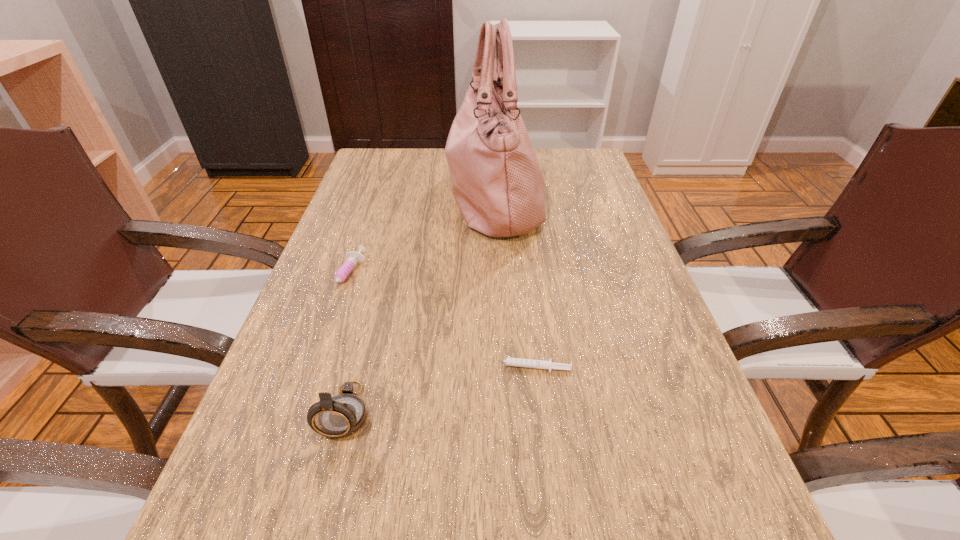
The width and height of the screenshot is (960, 540). Identify the location of vacant point located at the front of the tallest object with handles. pos(415,196).

Locate an element on the screen. This screenshot has width=960, height=540. blank space located on the face of the second tallest object is located at coordinates (319, 515).

Locate an element on the screen. This screenshot has height=540, width=960. free spot located on the front of the taller syringe is located at coordinates (321, 357).

Where is `blank space located 0.370m on the left of the nearer syringe`? blank space located 0.370m on the left of the nearer syringe is located at coordinates (274, 368).

This screenshot has height=540, width=960. Find the location of `object positioned at the far edge`. object positioned at the far edge is located at coordinates (498, 186).

Find the location of `compass situated at the left edge`. compass situated at the left edge is located at coordinates (340, 416).

Locate an element on the screen. syringe at the left edge is located at coordinates (354, 258).

In the image, there is a desktop. At what (x,y) coordinates should I click in order to perform the action: click on vacant space at the left edge. Please return your answer as a coordinate pair (x, y). Image resolution: width=960 pixels, height=540 pixels. Looking at the image, I should click on (374, 306).

The image size is (960, 540). In order to click on vacant area at the right edge in this screenshot , I will do click(591, 212).

Where is `free location at the far left corner`? This screenshot has width=960, height=540. free location at the far left corner is located at coordinates (396, 165).